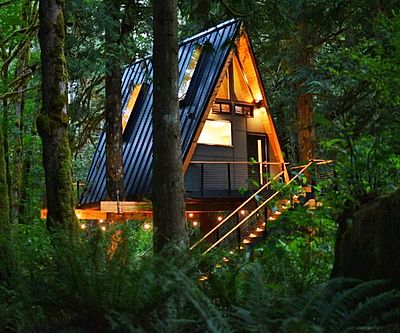
This screenshot has width=400, height=333. In order to click on middle of staircase in this screenshot , I will do `click(250, 233)`.